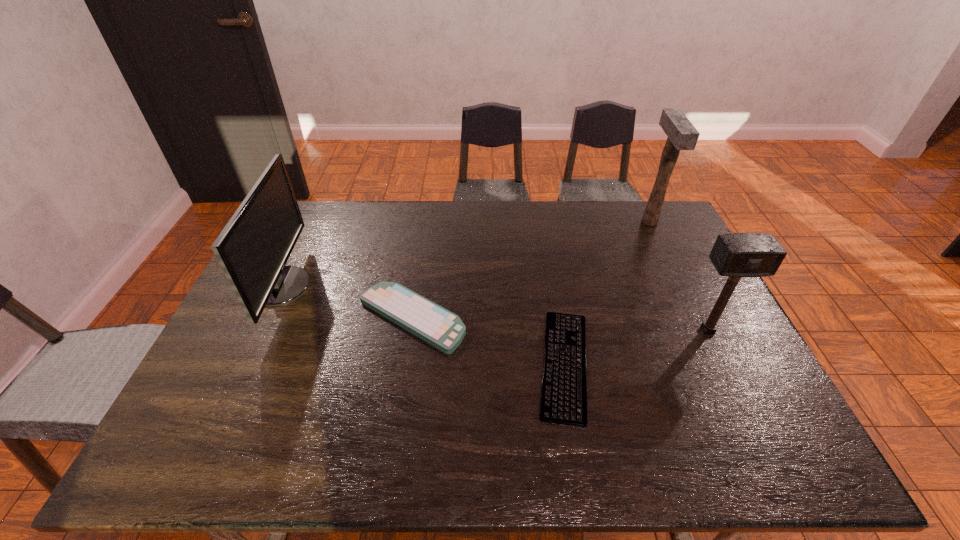
At what (x,y) coordinates should I click in order to perform the action: click on vacant area located 0.270m on the back of the nearer mallet. Please return your answer as a coordinate pair (x, y). Looking at the image, I should click on (672, 258).

Where is `vacant space situated 0.160m on the right of the taller computer keyboard`? vacant space situated 0.160m on the right of the taller computer keyboard is located at coordinates (522, 318).

Identify the location of free space located 0.260m on the left of the third object from right to left. The image size is (960, 540). (433, 364).

The width and height of the screenshot is (960, 540). What are the coordinates of `object located at the far edge` in the screenshot? It's located at (682, 135).

Find the location of a particular element. object present at the left edge is located at coordinates (253, 248).

I want to click on object that is positioned at the far right corner, so click(x=682, y=135).

Locate an element on the screen. vacant region at the far edge of the desktop is located at coordinates (381, 230).

Identify the location of free spot at the near edge of the desktop. (598, 456).

In the image, there is a desktop. Identify the location of vacant space at the left edge. This screenshot has height=540, width=960. (236, 311).

This screenshot has width=960, height=540. Identify the location of vacant region at the right edge of the desktop. (662, 287).